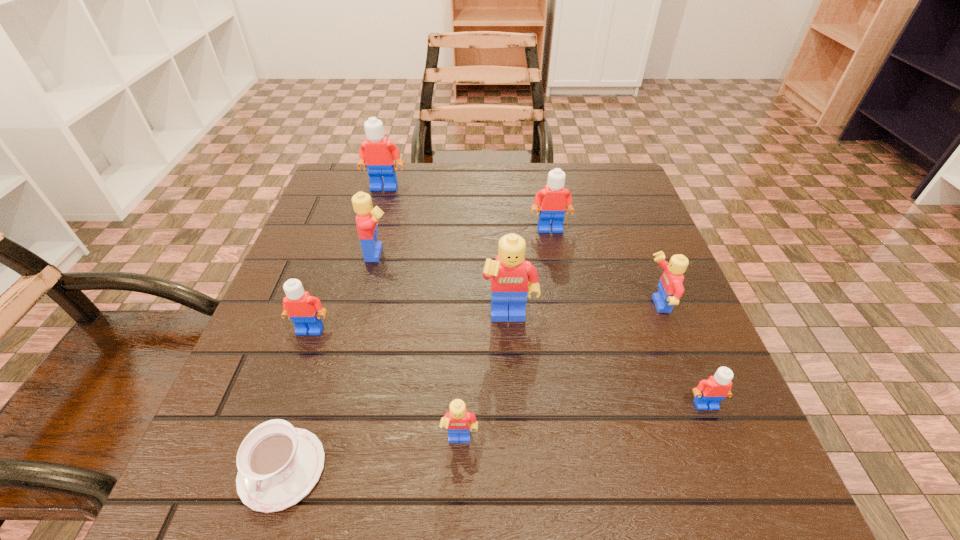
The height and width of the screenshot is (540, 960). In order to click on yellow Lego that is the third closest to the second nearest Lego in this screenshot , I will do `click(459, 422)`.

I want to click on white Lego object that ranks as the fourth closest to the fourth object from right to left, so point(377,153).

Identify the location of the second closest white Lego to the rightmost yellow Lego. (554, 200).

The image size is (960, 540). In order to click on vacant space that satisfies the following two spatial constraints: 1. on the face of the third biggest yellow Lego; 2. on the handle side of the teacup in this screenshot , I will do `click(720, 469)`.

This screenshot has height=540, width=960. Identify the location of free space that satisfies the following two spatial constraints: 1. on the face of the third farthest Lego; 2. on the handle side of the teacup. (325, 469).